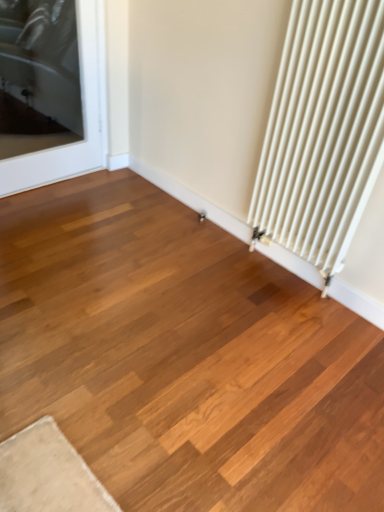
Where is `free space between transparent glass door at upper left and white matte radiator at right`? The height and width of the screenshot is (512, 384). free space between transparent glass door at upper left and white matte radiator at right is located at coordinates (146, 225).